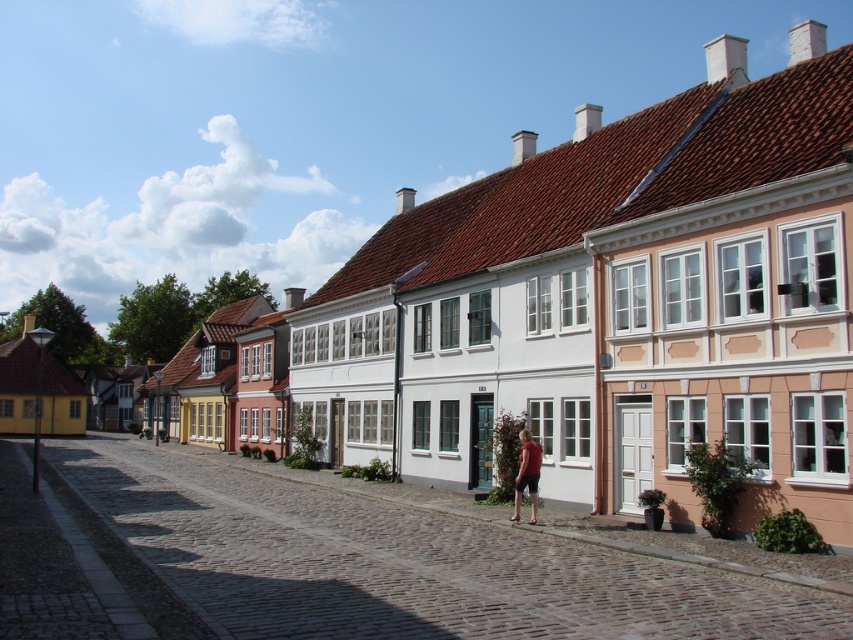
Between point (248, 497) and point (534, 502), which one is positioned behind?

Positioned behind is point (248, 497).

From the picture: Who is higher up, cobblestone street at center or matte red shirt at center?

Positioned higher is matte red shirt at center.

Describe the element at coordinates (404, 563) in the screenshot. I see `cobblestone street at center` at that location.

At what (x,y) coordinates should I click in order to perform the action: click on cobblestone street at center. Please return your answer as a coordinate pair (x, y). Looking at the image, I should click on (404, 563).